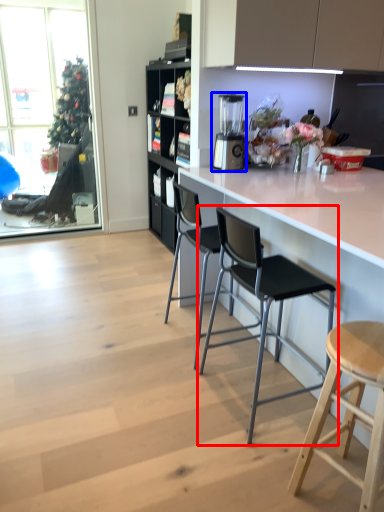
Question: Among these objects, which one is farthest to the camera, chair (highlighted by a red box) or appliance (highlighted by a blue box)?

Choices:
 (A) chair
 (B) appliance

Answer: (B)